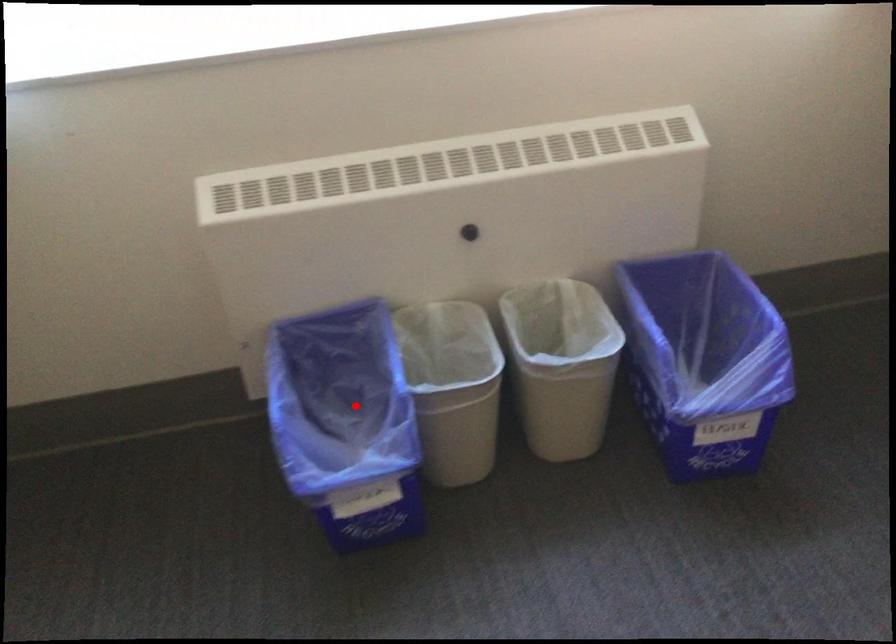
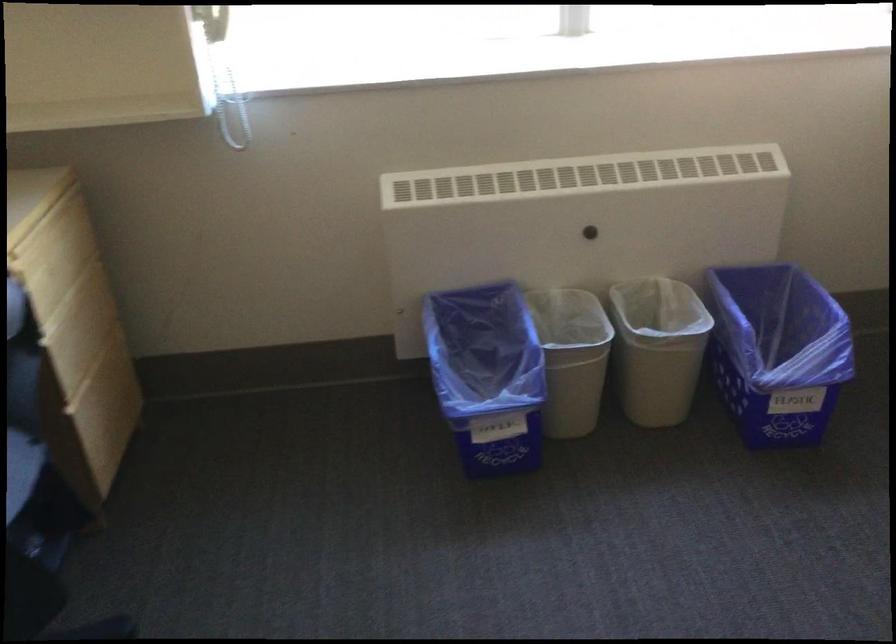
Question: I am providing you with two images of the same scene from different viewpoints. A red point is shown in image1. For the corresponding object point in image2, is it positioned nearer or farther from the camera?

Choices:
 (A) Nearer
 (B) Farther

Answer: (B)